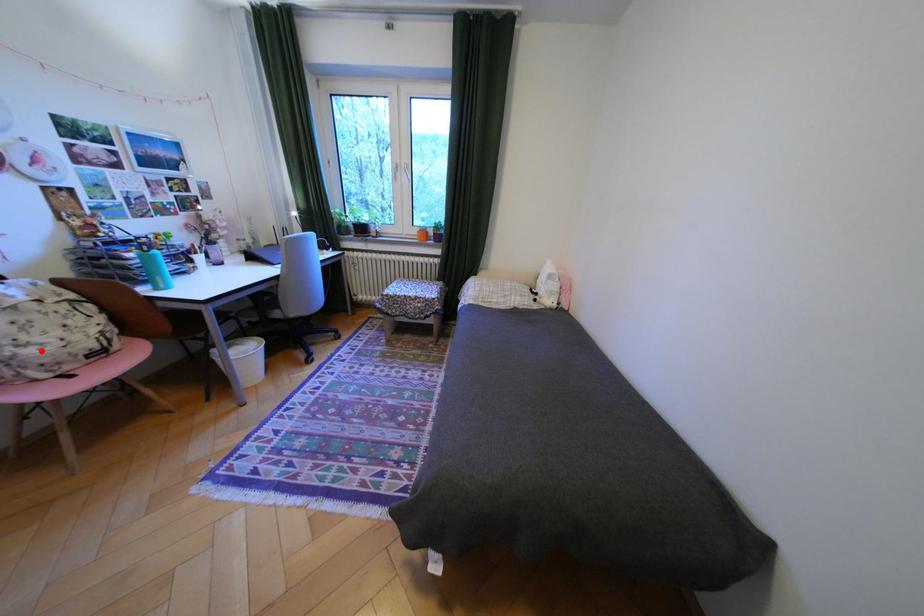
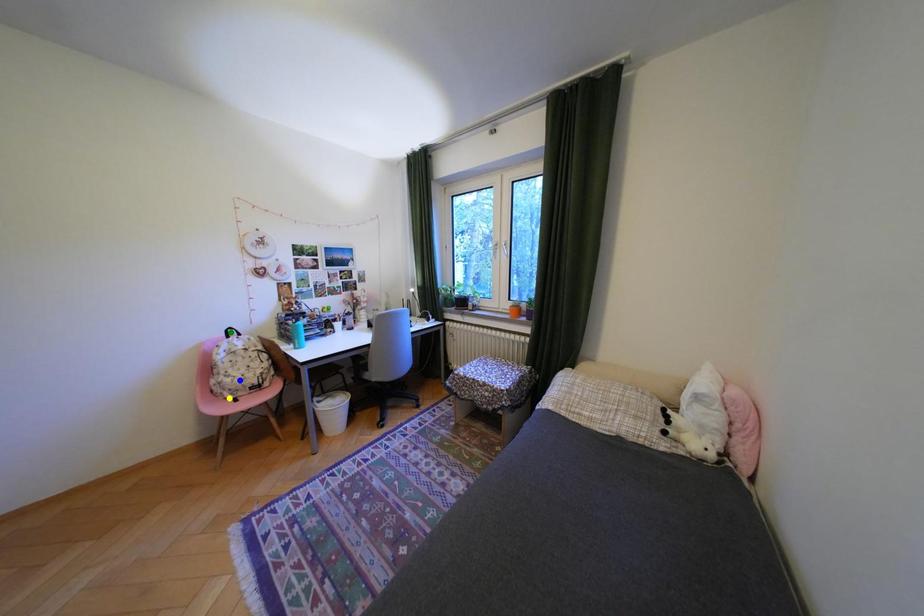
Question: I am providing you with two images of the same scene from different viewpoints. A red point is marked on the first image. You are given multiple points on the second image. Which mark in image 2 goes with the point in image 1?

Choices:
 (A) green point
 (B) yellow point
 (C) blue point

Answer: (C)